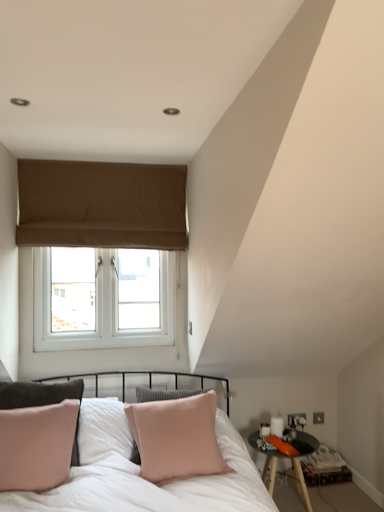
Question: From a real-world perspective, is black wooden table at lower right below pink velvet pillow at center?

Choices:
 (A) no
 (B) yes

Answer: (B)

Question: Is the depth of black wooden table at lower right less than that of pink velvet pillow at center?

Choices:
 (A) no
 (B) yes

Answer: (A)

Question: Considering the relative sizes of black wooden table at lower right and pink velvet pillow at center in the image provided, is black wooden table at lower right smaller than pink velvet pillow at center?

Choices:
 (A) yes
 (B) no

Answer: (A)

Question: Is black wooden table at lower right facing away from pink velvet pillow at center?

Choices:
 (A) yes
 (B) no

Answer: (B)

Question: Is black wooden table at lower right shorter than pink velvet pillow at center?

Choices:
 (A) yes
 (B) no

Answer: (A)

Question: Relative to pink velvet pillow at center, is brown fabric window at upper center in front or behind?

Choices:
 (A) behind
 (B) front

Answer: (A)

Question: Is brown fabric window at upper center spatially inside pink velvet pillow at center, or outside of it?

Choices:
 (A) inside
 (B) outside

Answer: (B)

Question: Visually, is brown fabric window at upper center positioned to the left or to the right of pink velvet pillow at center?

Choices:
 (A) left
 (B) right

Answer: (A)

Question: Is brown fabric window at upper center wider or thinner than pink velvet pillow at center?

Choices:
 (A) wide
 (B) thin

Answer: (B)

Question: In terms of size, does black wooden table at lower right appear bigger or smaller than pink velvet pillow at center?

Choices:
 (A) small
 (B) big

Answer: (A)

Question: Does point (296, 463) appear closer or farther from the camera than point (145, 431)?

Choices:
 (A) farther
 (B) closer

Answer: (A)

Question: Looking at their shapes, would you say black wooden table at lower right is wider or thinner than pink velvet pillow at center?

Choices:
 (A) thin
 (B) wide

Answer: (B)

Question: Is black wooden table at lower right inside the boundaries of pink velvet pillow at center, or outside?

Choices:
 (A) outside
 (B) inside

Answer: (A)

Question: Relative to brown fabric window at upper center, is pink velvet pillow at center in front or behind?

Choices:
 (A) behind
 (B) front

Answer: (B)

Question: Considering the positions of pink velvet pillow at center and brown fabric window at upper center in the image, is pink velvet pillow at center wider or thinner than brown fabric window at upper center?

Choices:
 (A) thin
 (B) wide

Answer: (B)